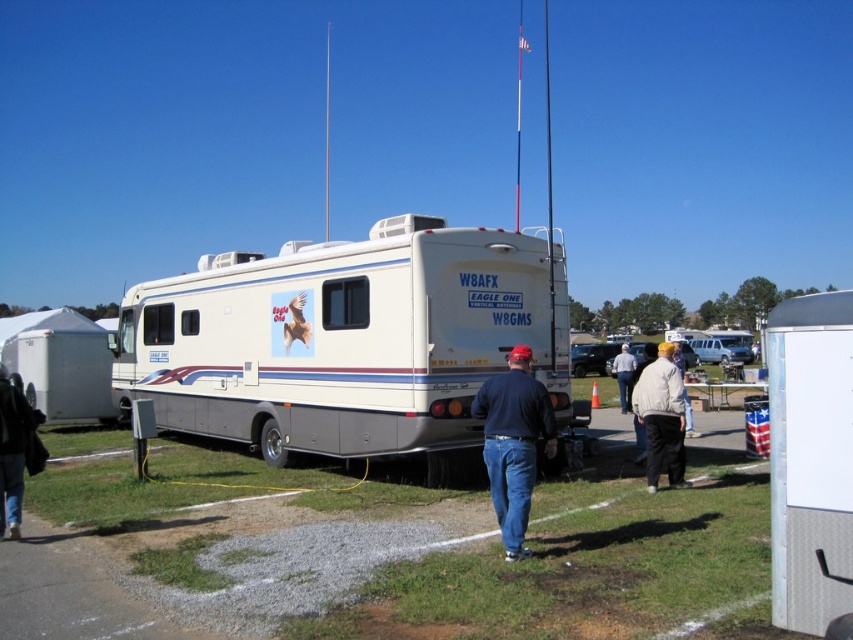
In the scene shown: You are a fashion designer looking at an outfit composed of the blue denim jeans at center and the white cotton shirt at center. Which piece of clothing is shorter in height?

The blue denim jeans at center is not as tall as the white cotton shirt at center, so the blue denim jeans at center is shorter in height.

You are standing in front of the RV and see the blue denim jeans at center and the light beige jacket at center. Which item is located to the left when viewed from the front of the RV?

The blue denim jeans at center is positioned on the left side of the light beige jacket at center, so when viewed from the front of the RV, the blue denim jeans at center is to the left of the light beige jacket at center.

You are packing a suitcase and see the blue denim jeans at center and the white cotton shirt at center. Which item takes up less space in the suitcase?

The blue denim jeans at center is thinner than the white cotton shirt at center, so it takes up less space in the suitcase.